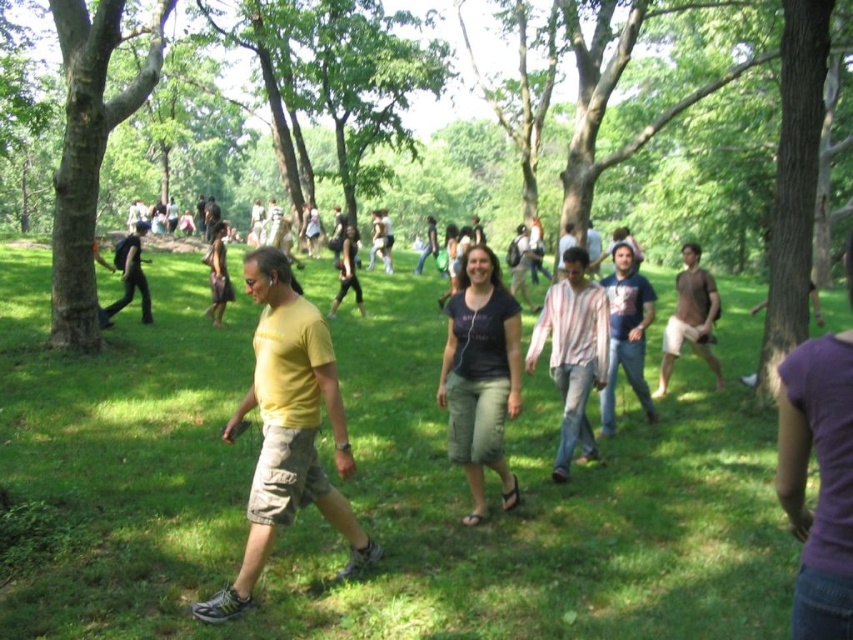
Question: Which point is farther from the camera taking this photo?

Choices:
 (A) (634, 282)
 (B) (260, 477)
 (C) (126, 298)

Answer: (C)

Question: Is brown cotton shirt at center-right closer to the viewer compared to matte gray hoodie at center?

Choices:
 (A) no
 (B) yes

Answer: (A)

Question: Which object is closer to the camera taking this photo?

Choices:
 (A) dark blue t-shirt at center
 (B) matte black shirt at center
 (C) matte white shirt at center

Answer: (A)

Question: Can you confirm if matte black shirt at center is wider than matte white shirt at center?

Choices:
 (A) no
 (B) yes

Answer: (A)

Question: Does yellow t-shirt at center appear on the left side of matte white shirt at center?

Choices:
 (A) yes
 (B) no

Answer: (A)

Question: Which of the following is the farthest from the observer?

Choices:
 (A) yellow matte t-shirt at center
 (B) matte gray hoodie at center
 (C) dark blue t-shirt at center
 (D) striped cotton shirt at center

Answer: (B)